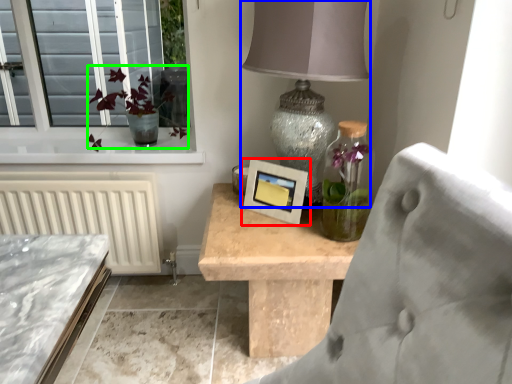
Question: Based on their relative distances, which object is nearer to picture frame (highlighted by a red box)? Choose from table lamp (highlighted by a blue box) and floral arrangement (highlighted by a green box).

Choices:
 (A) table lamp
 (B) floral arrangement

Answer: (A)